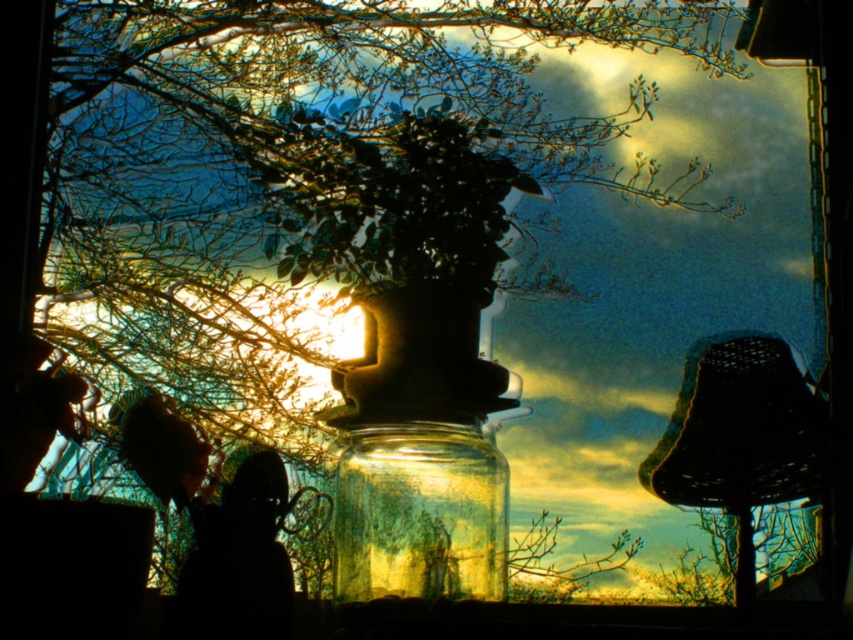
Question: Is transparent glass jar at center below black woven lampshade at right?

Choices:
 (A) yes
 (B) no

Answer: (A)

Question: Is transparent glass jar at center to the right of black woven lampshade at right from the viewer's perspective?

Choices:
 (A) no
 (B) yes

Answer: (A)

Question: Among these points, which one is farthest from the camera?

Choices:
 (A) (764, 432)
 (B) (425, 582)

Answer: (B)

Question: Which point appears closest to the camera in this image?

Choices:
 (A) (374, 440)
 (B) (790, 404)

Answer: (B)

Question: In this image, where is transparent glass jar at center located relative to black woven lampshade at right?

Choices:
 (A) above
 (B) below

Answer: (B)